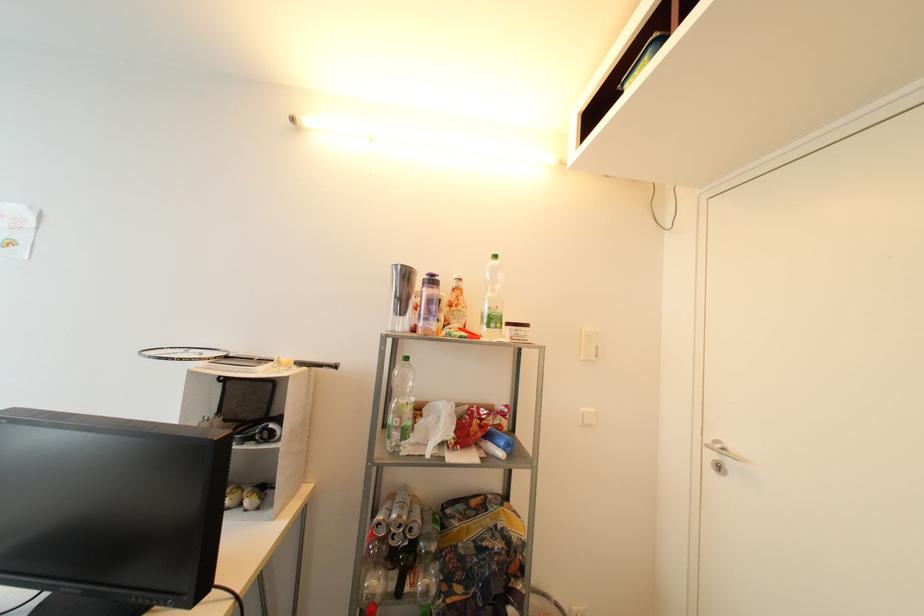
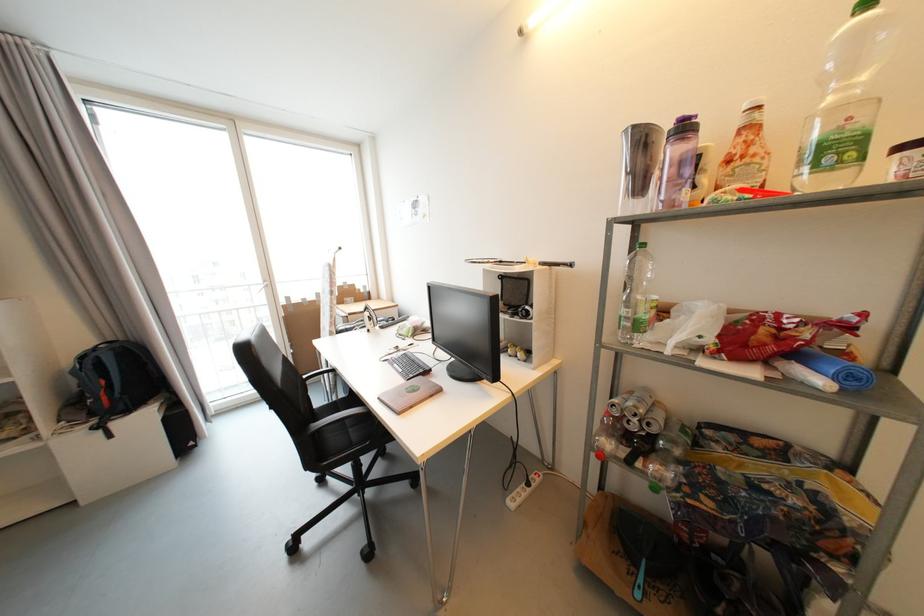
Find the pixel in the second image that matches point 403,544 in the first image.

(638, 430)